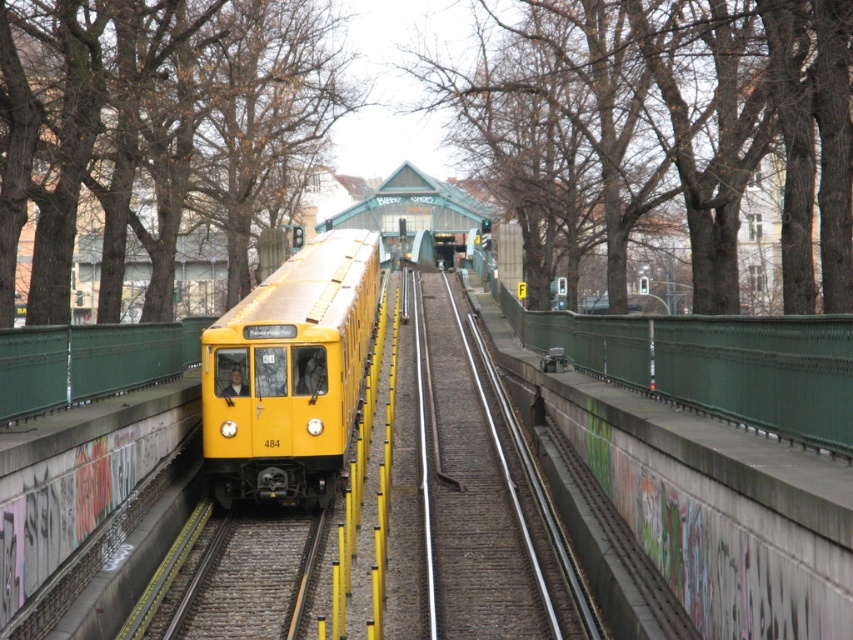
Between point (45, 193) and point (322, 461), which one is positioned behind?

Point (322, 461)

Can you confirm if brown leafless tree at left is wider than yellow matte train at center?

Yes.

The width and height of the screenshot is (853, 640). In order to click on brown leafless tree at left in this screenshot , I will do `click(105, 129)`.

I want to click on brown leafless tree at left, so click(105, 129).

Can you confirm if bare branches at upper center is smaller than yellow matte train at center?

Actually, bare branches at upper center might be larger than yellow matte train at center.

Does bare branches at upper center have a lesser width compared to yellow matte train at center?

No, bare branches at upper center is not thinner than yellow matte train at center.

Between point (795, 156) and point (326, 292), which one is positioned in front?

Point (795, 156) is more forward.

At what (x,y) coordinates should I click in order to perform the action: click on bare branches at upper center. Please return your answer as a coordinate pair (x, y). Looking at the image, I should click on (712, 115).

Looking at this image, does bare branches at upper center appear over brown leafless tree at left?

Yes, bare branches at upper center is above brown leafless tree at left.

Is point (596, 10) in front of point (276, 132)?

Yes, it is.

Find the location of a particular element. The image size is (853, 640). bare branches at upper center is located at coordinates (712, 115).